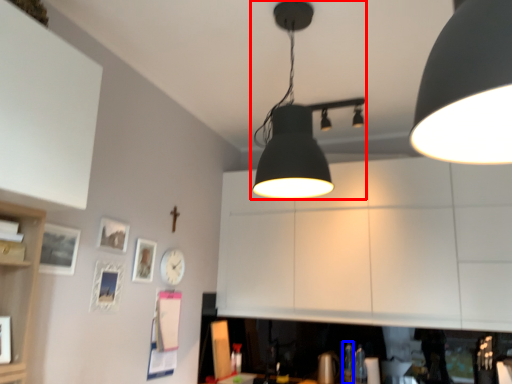
Question: Which object is closer to the camera taking this photo, lamp (highlighted by a red box) or bottle (highlighted by a blue box)?

Choices:
 (A) lamp
 (B) bottle

Answer: (A)